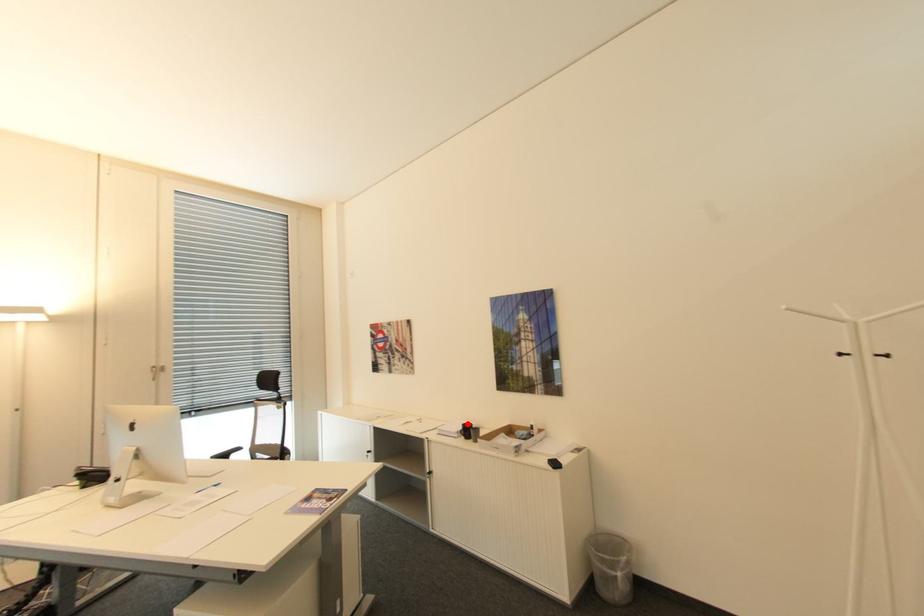
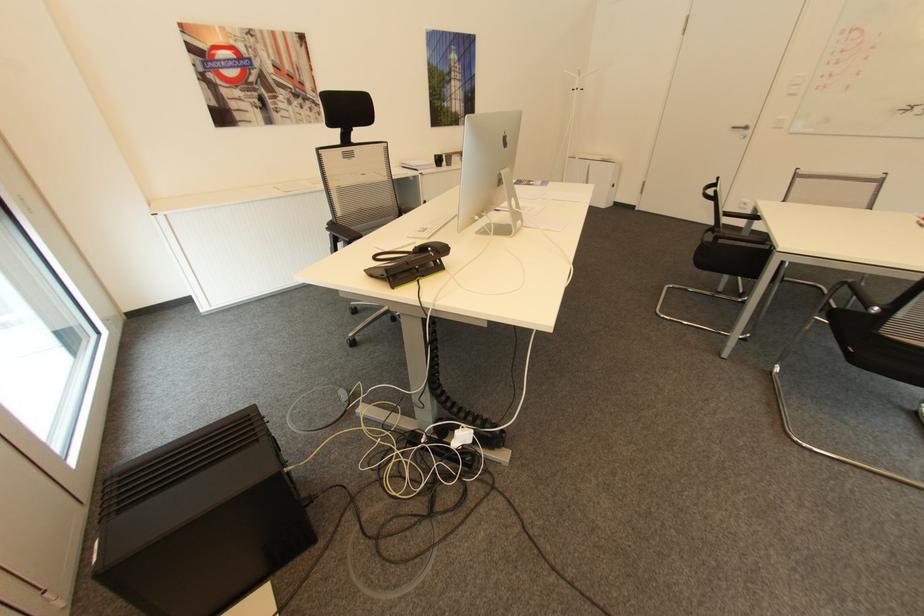
Question: A red point is marked in image1. In image2, is the corresponding 3D point closer to the camera or farther? Reply with the corresponding letter.

Choices:
 (A) The corresponding 3D point is closer.
 (B) The corresponding 3D point is farther.

Answer: (A)